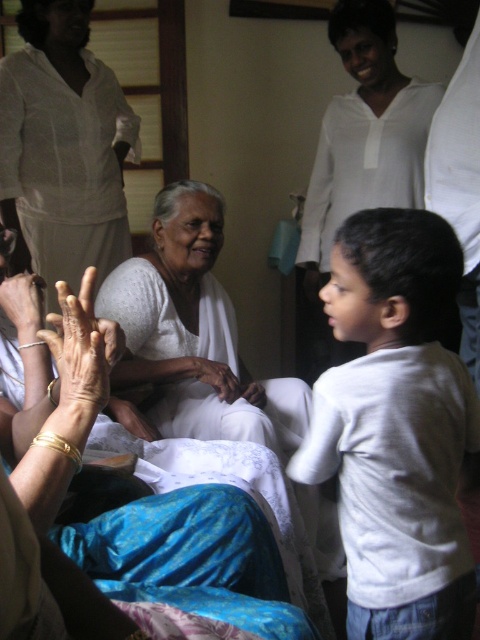
You are a photographer trying to capture a candid shot of the elderly woman and the child in the scene. You need to position yourself so that both the white fabric at center and white cloth at center are visible in the frame. Given their distance apart, do you think you can fit both into your camera viewfinder without moving your position?

The white fabric at center and white cloth at center are 3.84 feet apart from each other. Since they are only about 3.84 feet apart, it should be possible to frame both within the camera viewfinder without needing to adjust your position, assuming the viewfinder has a standard field of view.

In the scene, you see the dry skin hand at lower left and the gold bracelet at lower left. Which object has a greater width?

The dry skin hand at lower left has a greater width than the gold bracelet at lower left.